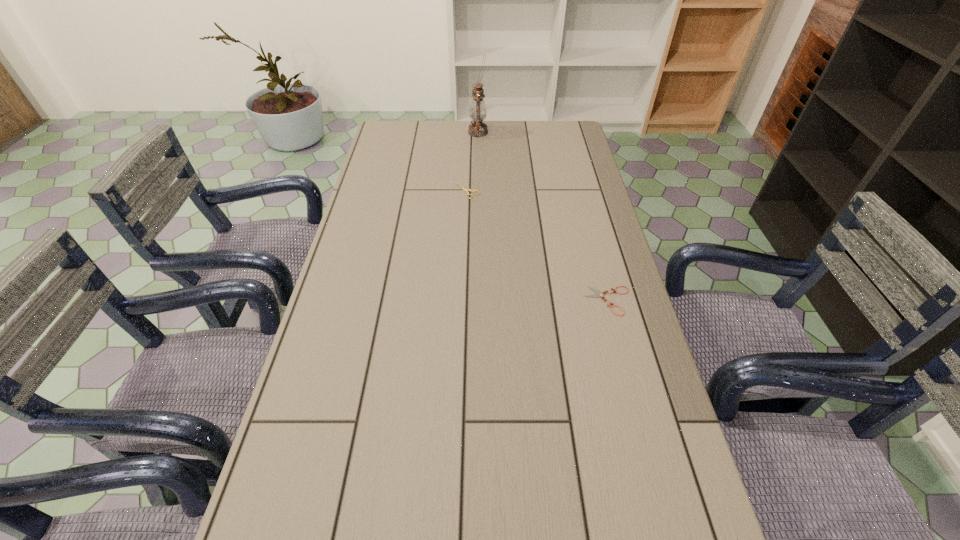
Where is `object that is at the right edge`? The image size is (960, 540). object that is at the right edge is located at coordinates (599, 294).

In the image, there is a desktop. Identify the location of vacant region at the far edge. Image resolution: width=960 pixels, height=540 pixels. [461, 141].

Find the location of `vacant area at the left edge`. vacant area at the left edge is located at coordinates (376, 242).

At what (x,y) coordinates should I click in order to perform the action: click on free space at the right edge. Please return your answer as a coordinate pair (x, y). The width and height of the screenshot is (960, 540). Looking at the image, I should click on (643, 532).

The height and width of the screenshot is (540, 960). In the image, there is a desktop. In order to click on free space at the far left corner in this screenshot , I will do `click(416, 120)`.

In the image, there is a desktop. Where is `vacant space at the far right corner`? vacant space at the far right corner is located at coordinates pyautogui.click(x=555, y=123).

The image size is (960, 540). In order to click on free spot between the second farthest object and the right shears in this screenshot , I will do `click(538, 246)`.

This screenshot has width=960, height=540. In order to click on vacant space that is in between the second nearest object and the farthest object in this screenshot , I will do `click(472, 162)`.

Image resolution: width=960 pixels, height=540 pixels. In order to click on free space between the nearer shears and the tallest object in this screenshot , I will do `click(543, 217)`.

Identify the location of empty space between the nearer shears and the farthest object. (543, 217).